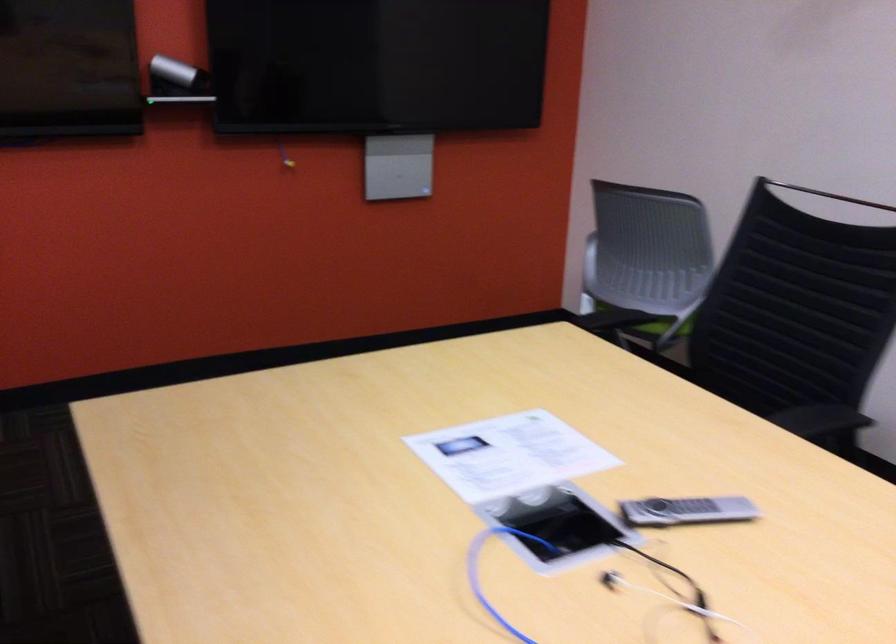
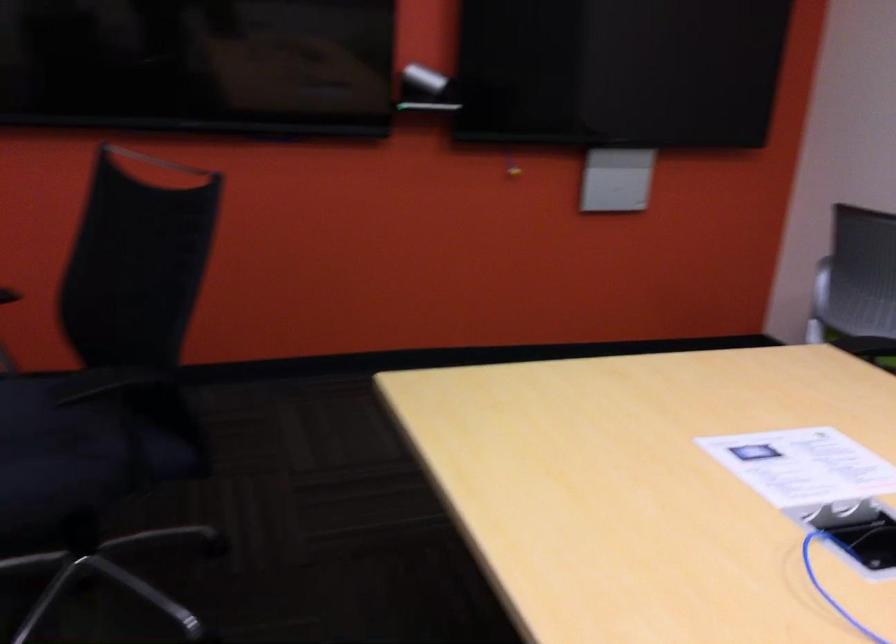
In the second image, find the point that corresponds to [561,503] in the first image.

(858, 532)